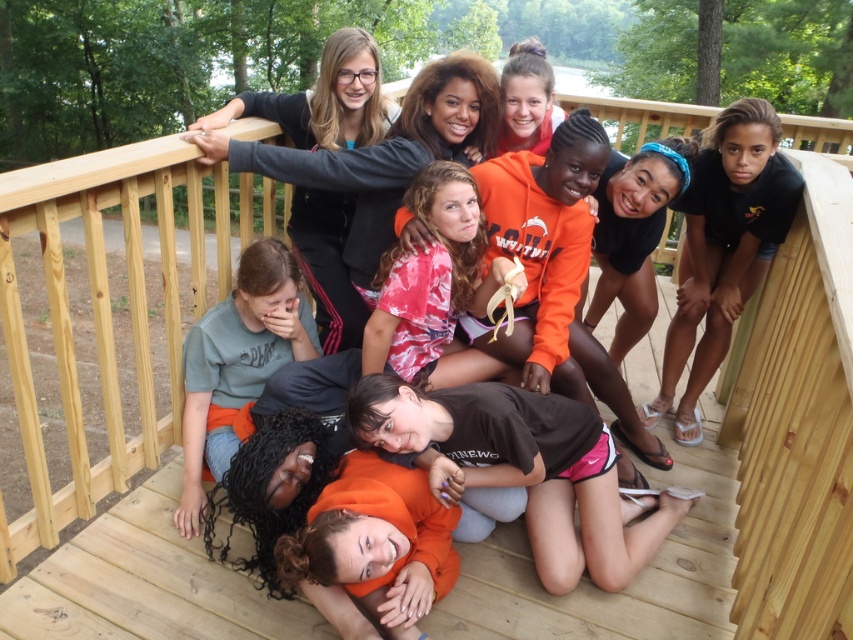
Which of these two, black matte shirt at upper right or green cotton shirt at lower left, stands shorter?

green cotton shirt at lower left is shorter.

Can you confirm if black matte shirt at upper right is positioned to the right of green cotton shirt at lower left?

Correct, you'll find black matte shirt at upper right to the right of green cotton shirt at lower left.

Locate an element on the screen. Image resolution: width=853 pixels, height=640 pixels. black matte shirt at upper right is located at coordinates (723, 248).

Which is behind, point (720, 300) or point (331, 225)?

Point (720, 300)

Is black matte shirt at upper right bigger than matte black jacket at upper center?

Indeed, black matte shirt at upper right has a larger size compared to matte black jacket at upper center.

I want to click on black matte shirt at upper right, so point(723,248).

Can you confirm if green cotton shirt at lower left is bigger than matte black jacket at upper center?

No, green cotton shirt at lower left is not bigger than matte black jacket at upper center.

This screenshot has width=853, height=640. Describe the element at coordinates (238, 364) in the screenshot. I see `green cotton shirt at lower left` at that location.

Who is more forward, (184, 424) or (309, 280)?

Point (184, 424)

You are a GUI agent. You are given a task and a screenshot of the screen. Output one action in this format:
    pyautogui.click(x=<x>, y=<y>)
    Task: Click on the green cotton shirt at lower left
    
    Given the screenshot: What is the action you would take?
    pyautogui.click(x=238, y=364)